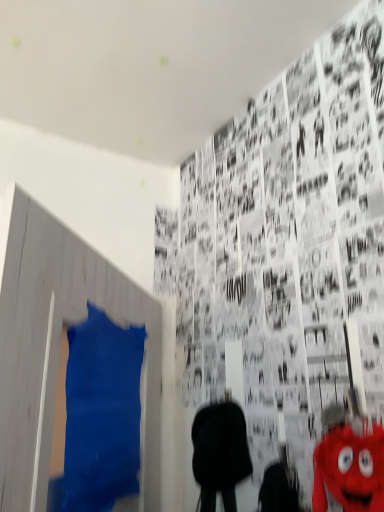
You are a GUI agent. You are given a task and a screenshot of the screen. Output one action in this format:
    pyautogui.click(x=<x>, y=<y>)
    Task: Click on the matte red plush toy at lower right
    The height and width of the screenshot is (512, 384).
    Given the screenshot: What is the action you would take?
    pyautogui.click(x=350, y=469)

Measure the distance between matte red plush toy at lower right and camera.

The depth of matte red plush toy at lower right is 25.42 inches.

What do you see at coordinates (350, 469) in the screenshot?
I see `matte red plush toy at lower right` at bounding box center [350, 469].

The image size is (384, 512). Find the location of `matte red plush toy at lower right`. matte red plush toy at lower right is located at coordinates (350, 469).